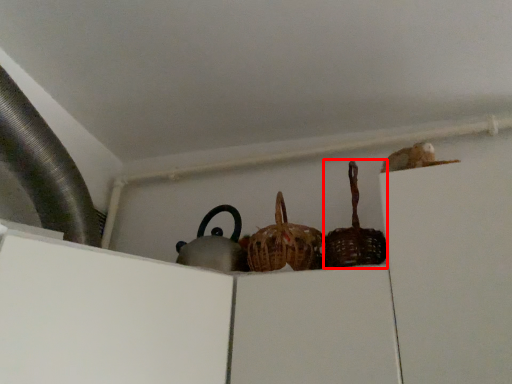
Question: From the image's perspective, what is the correct spatial positioning of basket (annotated by the red box) in reference to basket?

Choices:
 (A) above
 (B) below

Answer: (A)